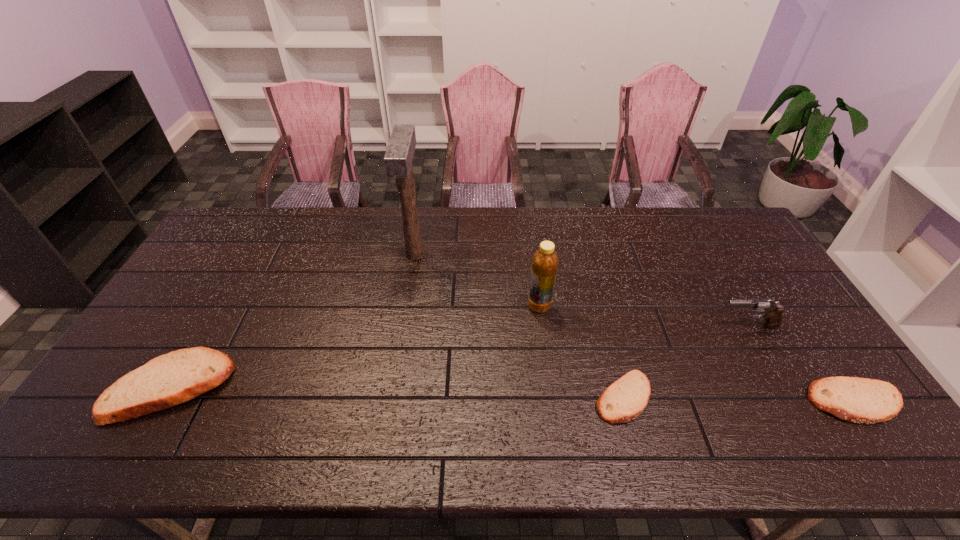
Where is `vacant space at the far left corner of the desktop`? Image resolution: width=960 pixels, height=540 pixels. vacant space at the far left corner of the desktop is located at coordinates (253, 212).

Locate an element on the screen. free space that is in between the rightmost pita bread and the leftmost object is located at coordinates (514, 395).

Identify the location of vacant region between the shortest pita bread and the second farthest object. (581, 352).

Identify the location of free space between the leftmost pita bread and the tallest object. (293, 321).

Locate an element on the screen. The height and width of the screenshot is (540, 960). free point between the mallet and the rightmost pita bread is located at coordinates (636, 328).

Image resolution: width=960 pixels, height=540 pixels. In order to click on free spot between the farthest object and the shortest object in this screenshot , I will do click(x=519, y=326).

This screenshot has width=960, height=540. I want to click on unoccupied area between the second shortest object and the third shortest object, so click(514, 395).

Locate an element on the screen. The width and height of the screenshot is (960, 540). blank region between the tallest object and the fifth nearest object is located at coordinates (477, 280).

This screenshot has height=540, width=960. Find the location of `vacant area that lies between the mallet and the leftmost pita bread`. vacant area that lies between the mallet and the leftmost pita bread is located at coordinates (293, 321).

The image size is (960, 540). Identify the location of free space between the fourth object from right to left and the second object from left to right. (477, 280).